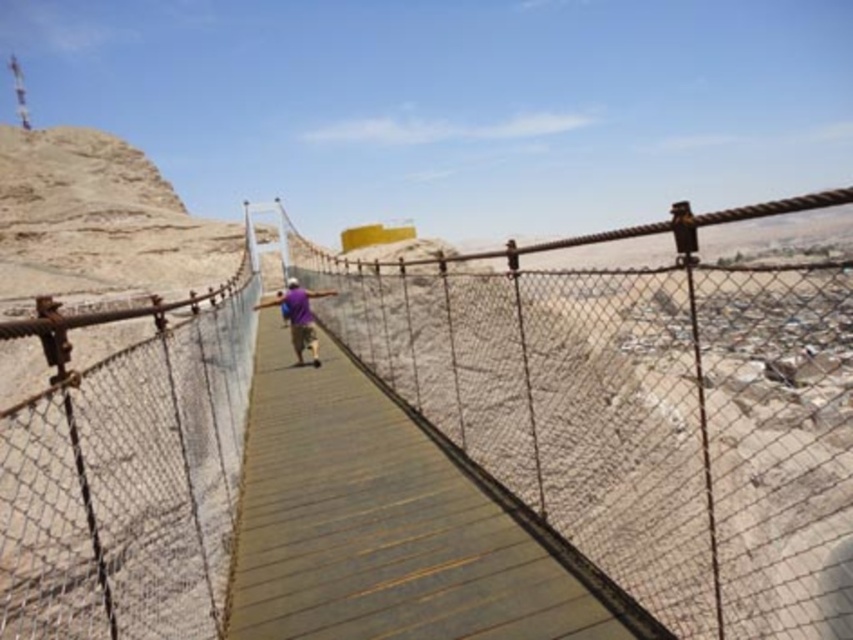
Question: Considering the real-world distances, which object is closest to the wooden at center?

Choices:
 (A) rusty metal suspension bridge at center
 (B) purple fabric shirt at center

Answer: (B)

Question: In this image, where is wooden at center located relative to purple fabric shirt at center?

Choices:
 (A) left
 (B) right

Answer: (B)

Question: Is wooden at center wider than purple fabric shirt at center?

Choices:
 (A) no
 (B) yes

Answer: (A)

Question: Which is nearer to the rusty metal suspension bridge at center?

Choices:
 (A) wooden at center
 (B) purple fabric shirt at center

Answer: (A)

Question: Which of these objects is positioned farthest from the purple fabric shirt at center?

Choices:
 (A) wooden at center
 (B) rusty metal suspension bridge at center

Answer: (B)

Question: Is rusty metal suspension bridge at center below wooden at center?

Choices:
 (A) yes
 (B) no

Answer: (B)